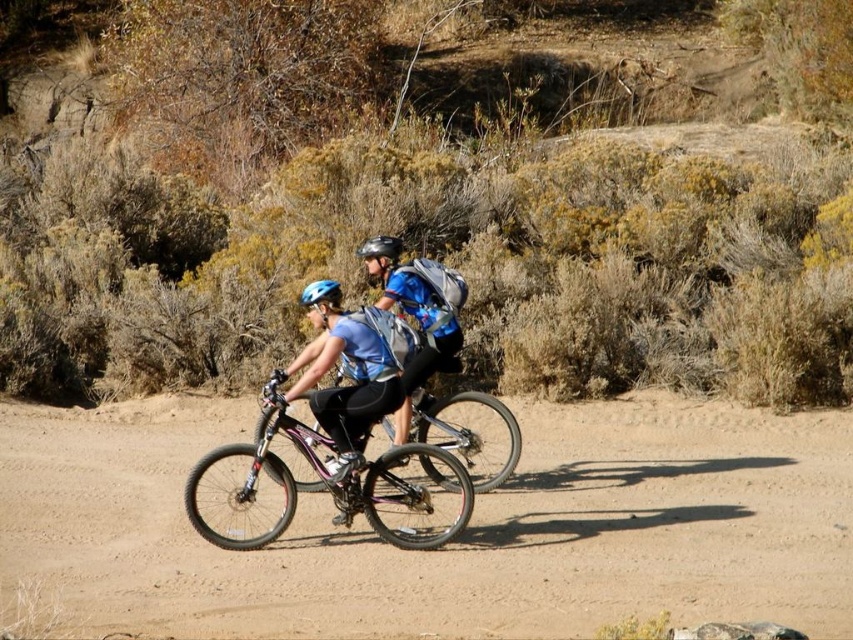
Question: Can you confirm if shiny purple bicycle at center is bigger than matte blue helmet at center?

Choices:
 (A) yes
 (B) no

Answer: (A)

Question: Considering the real-world distances, which object is closest to the shiny purple bicycle at center?

Choices:
 (A) metallic reflective helmet at center
 (B) matte blue helmet at center

Answer: (B)

Question: Among these objects, which one is farthest from the camera?

Choices:
 (A) matte blue helmet at center
 (B) blue matte helmet at center

Answer: (B)

Question: Can you confirm if shiny purple bicycle at center is positioned below matte blue helmet at center?

Choices:
 (A) no
 (B) yes

Answer: (B)

Question: Among these points, which one is farthest from the camera?

Choices:
 (A) (225, 545)
 (B) (296, 388)
 (C) (334, 285)

Answer: (C)

Question: Does shiny purple bicycle at center have a smaller size compared to matte blue helmet at center?

Choices:
 (A) yes
 (B) no

Answer: (B)